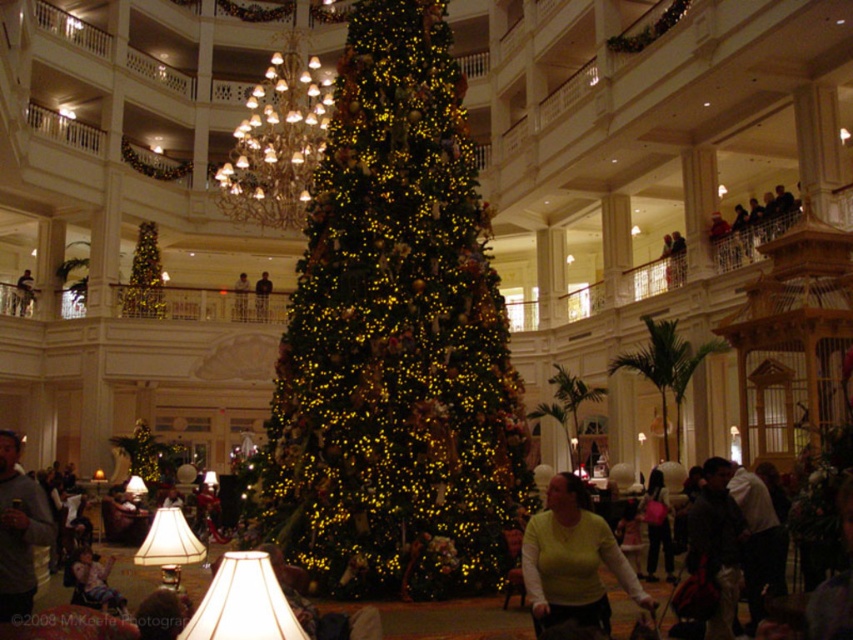
You are standing in the luxurious holiday building and want to take a photo of the shiny gold christmas tree at lower left. Where should you position yourself to capture it in your camera frame?

You should position yourself facing the shiny gold christmas tree at lower left located at point (144, 276) to capture it in your camera frame.